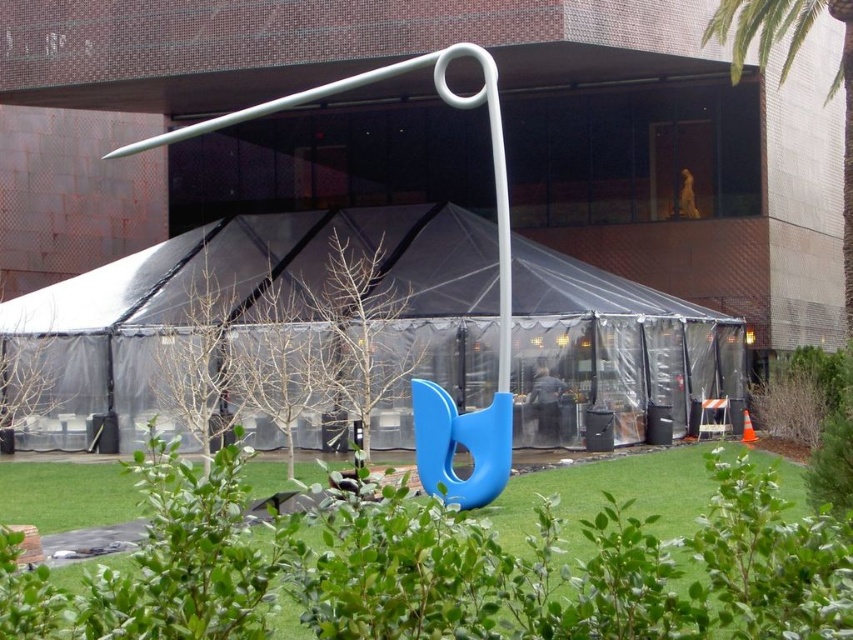
Question: Which point appears closest to the camera in this image?

Choices:
 (A) (730, 349)
 (B) (149, 637)
 (C) (802, 417)

Answer: (B)

Question: Among these points, which one is nearest to the camera?

Choices:
 (A) (222, 476)
 (B) (808, 362)

Answer: (A)

Question: Is transparent plastic tent at center to the left of green leafy bush at lower right from the viewer's perspective?

Choices:
 (A) no
 (B) yes

Answer: (B)

Question: Does transparent plastic tent at center appear over green leafy bush at lower right?

Choices:
 (A) yes
 (B) no

Answer: (A)

Question: Which object is positioned farthest from the transparent plastic tent at center?

Choices:
 (A) green leafy bush at lower right
 (B) green grass at center

Answer: (B)

Question: Observing the image, what is the correct spatial positioning of transparent plastic tent at center in reference to green leafy bush at lower right?

Choices:
 (A) above
 (B) below

Answer: (A)